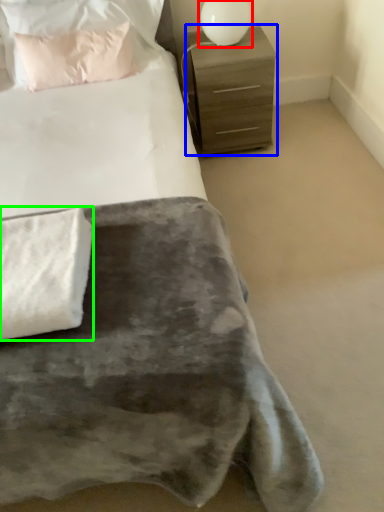
Question: Which object is the closest to the table lamp (highlighted by a red box)? Choose among these: chest of drawers (highlighted by a blue box) or blanket (highlighted by a green box).

Choices:
 (A) chest of drawers
 (B) blanket

Answer: (A)